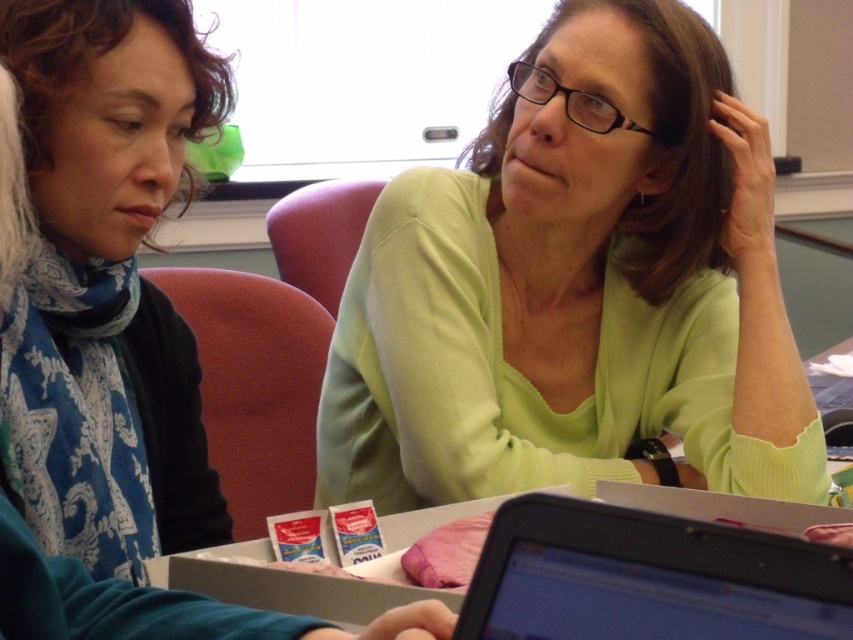
How far apart are green matte sweater at center and matte green sweater at center?

green matte sweater at center is 19.50 inches away from matte green sweater at center.

Which is behind, point (335, 445) or point (3, 579)?

The point (335, 445) is behind.

Between point (532, 336) and point (126, 413), which one is positioned in front?

Point (126, 413) is in front.

You are a GUI agent. You are given a task and a screenshot of the screen. Output one action in this format:
    pyautogui.click(x=<x>, y=<y>)
    Task: Click on the green matte sweater at center
    The image size is (853, 640).
    Given the screenshot: What is the action you would take?
    pyautogui.click(x=575, y=289)

Which of these two, matte green sweater at center or black plastic laptop at lower center, stands taller?

Standing taller between the two is matte green sweater at center.

You are a GUI agent. You are given a task and a screenshot of the screen. Output one action in this format:
    pyautogui.click(x=<x>, y=<y>)
    Task: Click on the matte green sweater at center
    Image resolution: width=853 pixels, height=640 pixels.
    Given the screenshot: What is the action you would take?
    pyautogui.click(x=109, y=333)

At what (x,y) coordinates should I click in order to perform the action: click on matte green sweater at center. Please return your answer as a coordinate pair (x, y). The width and height of the screenshot is (853, 640). Looking at the image, I should click on (109, 333).

Does green matte sweater at center appear under black plastic laptop at lower center?

Incorrect, green matte sweater at center is not positioned below black plastic laptop at lower center.

Is green matte sweater at center taller than black plastic laptop at lower center?

Yes, green matte sweater at center is taller than black plastic laptop at lower center.

Who is more forward, (727,237) or (753,563)?

Point (753,563)

What are the coordinates of `green matte sweater at center` in the screenshot? It's located at (575, 289).